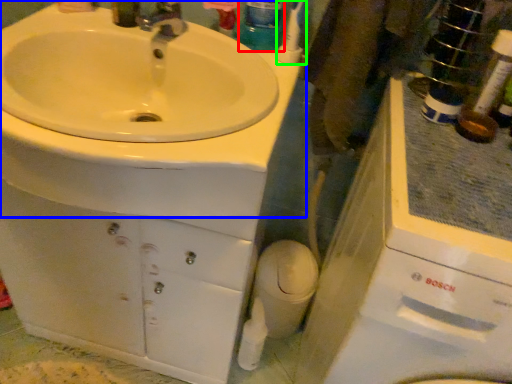
Question: Considering the real-world distances, which object is closest to mouthwash (highlighted by a red box)? sink (highlighted by a blue box) or toothbrush (highlighted by a green box).

Choices:
 (A) sink
 (B) toothbrush

Answer: (B)